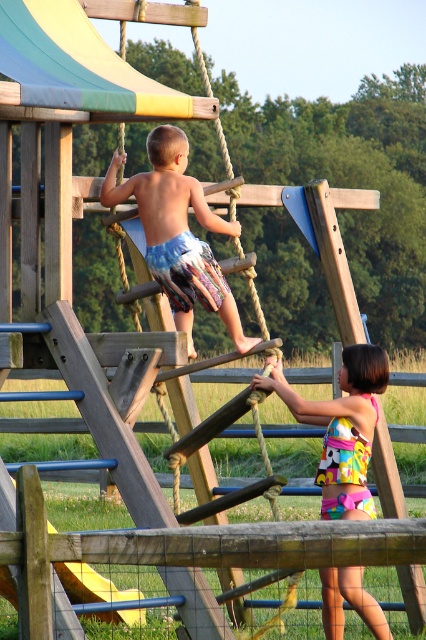
Does multicolored plastic slide at upper left have a greater width compared to yellow plastic slide at lower left?

Correct, the width of multicolored plastic slide at upper left exceeds that of yellow plastic slide at lower left.

Can you confirm if multicolored plastic slide at upper left is taller than yellow plastic slide at lower left?

Yes, multicolored plastic slide at upper left is taller than yellow plastic slide at lower left.

Which is in front, point (32, 48) or point (63, 580)?

Point (32, 48)

Image resolution: width=426 pixels, height=640 pixels. What are the coordinates of `multicolored plastic slide at upper left` in the screenshot? It's located at (74, 64).

The height and width of the screenshot is (640, 426). Describe the element at coordinates (342, 428) in the screenshot. I see `multicolored fabric swimsuit at center` at that location.

You are a GUI agent. You are given a task and a screenshot of the screen. Output one action in this format:
    pyautogui.click(x=<x>, y=<y>)
    Task: Click on the multicolored fabric swimsuit at center
    The height and width of the screenshot is (640, 426).
    Given the screenshot: What is the action you would take?
    pyautogui.click(x=342, y=428)

Find the location of `multicolored fabric swimsuit at center`. multicolored fabric swimsuit at center is located at coordinates (342, 428).

Is blue patterned shorts at center below yellow plastic slide at lower left?

No.

Does blue patterned shorts at center have a smaller size compared to yellow plastic slide at lower left?

No.

Is point (141, 209) less distant than point (144, 614)?

Yes, it is.

The height and width of the screenshot is (640, 426). In order to click on blue patterned shorts at center in this screenshot , I will do `click(178, 234)`.